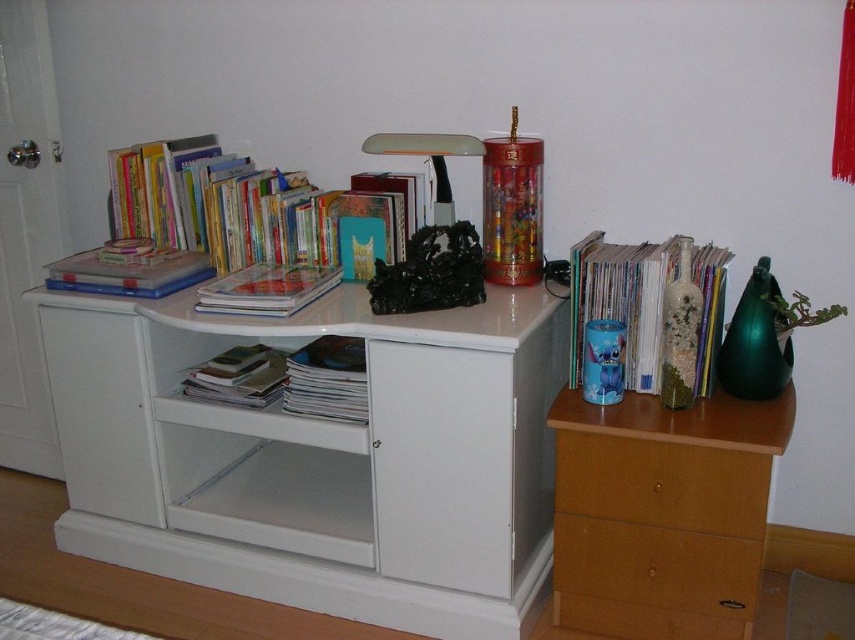
Question: Which object appears farthest from the camera in this image?

Choices:
 (A) matte blue cup at upper right
 (B) hardcover books at upper left

Answer: (B)

Question: Is black marble lamp at center to the left of hardcover book at upper left from the viewer's perspective?

Choices:
 (A) yes
 (B) no

Answer: (B)

Question: Can you confirm if wooden drawer at right is smaller than brown matte drawer at lower right?

Choices:
 (A) no
 (B) yes

Answer: (A)

Question: Which point is farther to the camera?

Choices:
 (A) white matte cabinet at center
 (B) wooden drawer at lower right
 (C) matte plastic book at center
 (D) hardcover book at upper left

Answer: (D)

Question: Is white matte cabinet at center positioned behind hardcover book at upper left?

Choices:
 (A) no
 (B) yes

Answer: (A)

Question: Which point is farther to the camera?

Choices:
 (A) wooden drawer at lower right
 (B) brown matte drawer at lower right
 (C) white matte cabinet at center

Answer: (B)